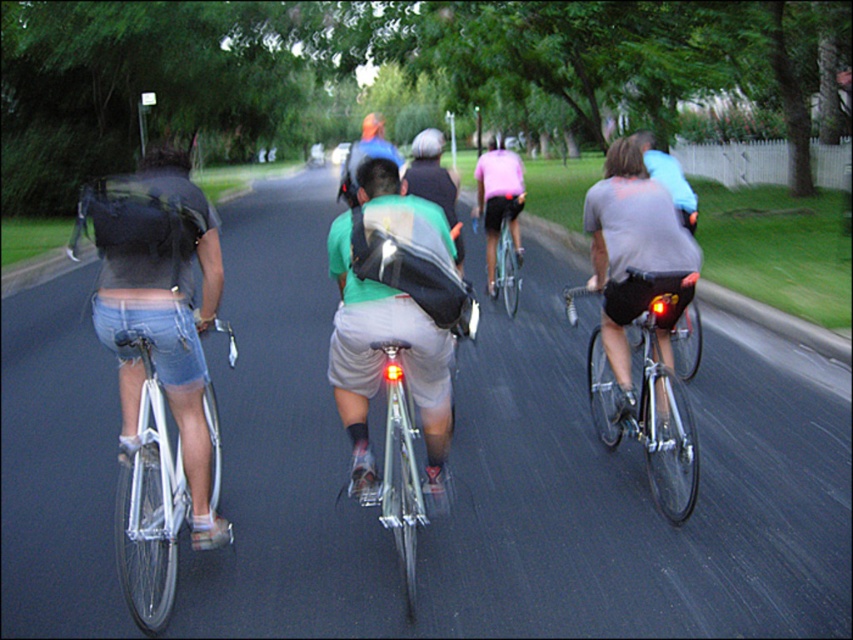
Can you confirm if shiny silver bicycle at center is bigger than shiny blue bicycle at center?

Yes, shiny silver bicycle at center is bigger than shiny blue bicycle at center.

Is shiny silver bicycle at center above shiny blue bicycle at center?

Actually, shiny silver bicycle at center is below shiny blue bicycle at center.

Does point (397, 422) come farther from viewer compared to point (521, 196)?

No.

In order to click on shiny silver bicycle at center in this screenshot , I will do `click(401, 472)`.

Which is more to the left, green fabric shirt at center or silver metallic bicycle at left?

silver metallic bicycle at left is more to the left.

Is point (358, 356) closer to viewer compared to point (134, 445)?

No.

This screenshot has width=853, height=640. Find the location of `green fabric shirt at center`. green fabric shirt at center is located at coordinates (383, 362).

Between green fabric shirt at center and shiny silver bicycle at center, which one is positioned lower?

shiny silver bicycle at center is below.

Can you confirm if green fabric shirt at center is positioned to the right of shiny silver bicycle at center?

Incorrect, green fabric shirt at center is not on the right side of shiny silver bicycle at center.

Measure the distance between point [404,186] and camera.

Point [404,186] and camera are 21.32 feet apart.

Where is `green fabric shirt at center`? green fabric shirt at center is located at coordinates pyautogui.click(x=383, y=362).